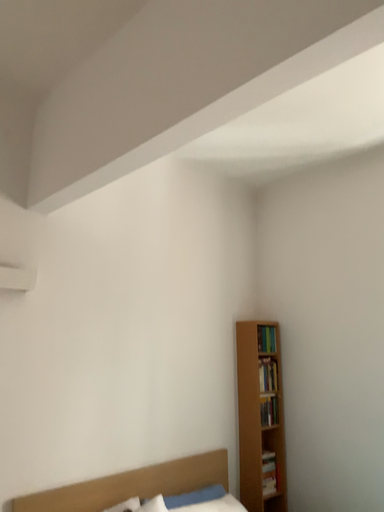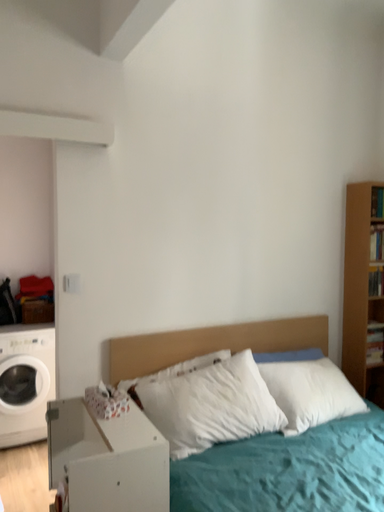
Question: Which way did the camera rotate in the video?

Choices:
 (A) rotated right
 (B) rotated left

Answer: (B)